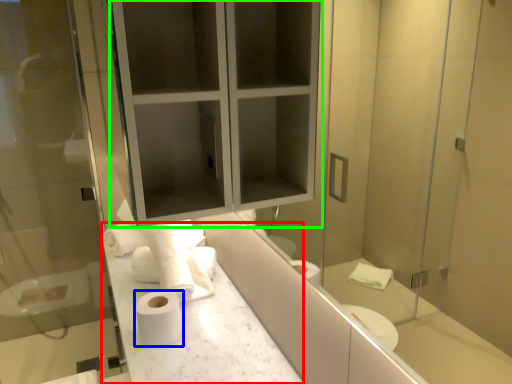
Question: Which is nearer to the counter top (highlighted by a red box)? toilet paper (highlighted by a blue box) or medicine cabinet (highlighted by a green box).

Choices:
 (A) toilet paper
 (B) medicine cabinet

Answer: (A)